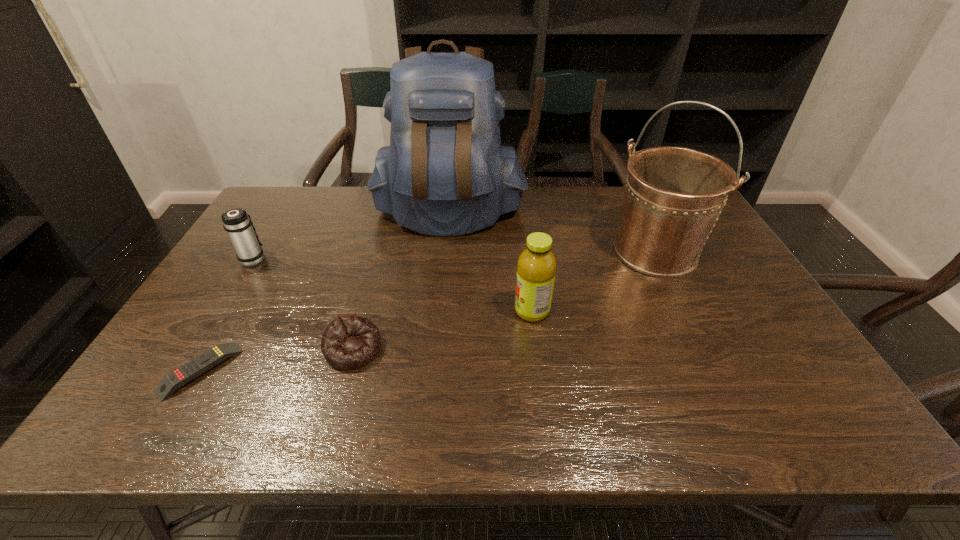
Locate an element on the screen. vacant space located 0.210m on the front label of the fruit juice is located at coordinates (434, 311).

I want to click on vacant area situated on the front label of the fruit juice, so click(476, 311).

Locate an element on the screen. Image resolution: width=960 pixels, height=540 pixels. vacant area situated 0.240m on the side with the handle of the thermos bottle is located at coordinates (284, 208).

Locate an element on the screen. This screenshot has width=960, height=540. vacant position located on the side with the handle of the thermos bottle is located at coordinates (290, 199).

The height and width of the screenshot is (540, 960). What are the coordinates of `blank space located on the side with the handle of the thermos bottle` in the screenshot? It's located at (276, 221).

This screenshot has width=960, height=540. In order to click on free space located on the left of the beanbag in this screenshot , I will do `click(251, 349)`.

The image size is (960, 540). What are the coordinates of `vacant area located 0.370m on the back of the shortest object` in the screenshot? It's located at pos(271,251).

Where is `object that is at the far edge`? object that is at the far edge is located at coordinates (445, 173).

Where is `object at the near edge`? This screenshot has height=540, width=960. object at the near edge is located at coordinates (182, 375).

In order to click on thermos bottle that is at the left edge in this screenshot , I will do `click(237, 223)`.